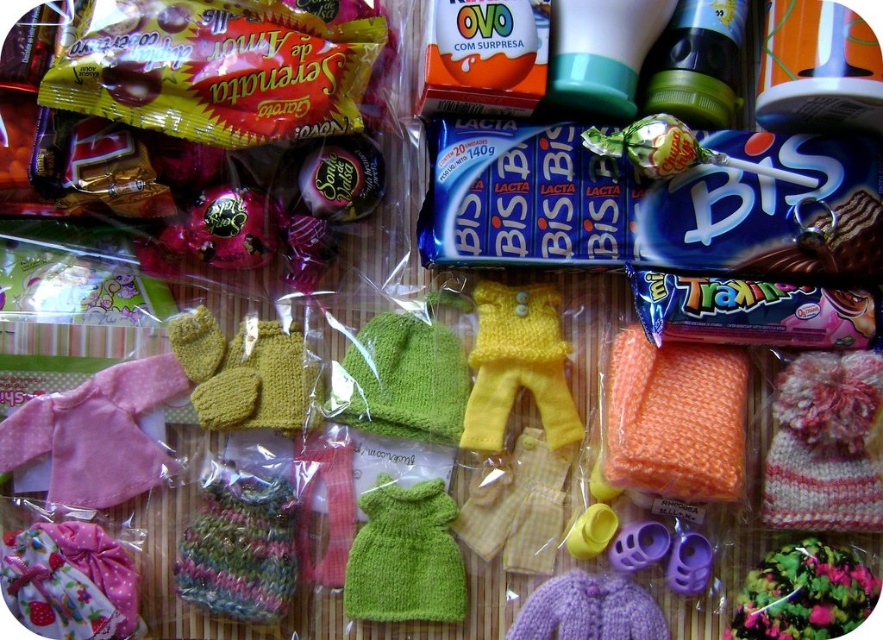
You are organizing a gift basket and need to place the knitted pink hat at center right and the green knitted dress at center into the basket. Which item should you place first to ensure the shorter one is on top for visibility?

Since the knitted pink hat at center right is taller than the green knitted dress at center, you should place the green knitted dress at center first so that the shorter item is on top for better visibility.